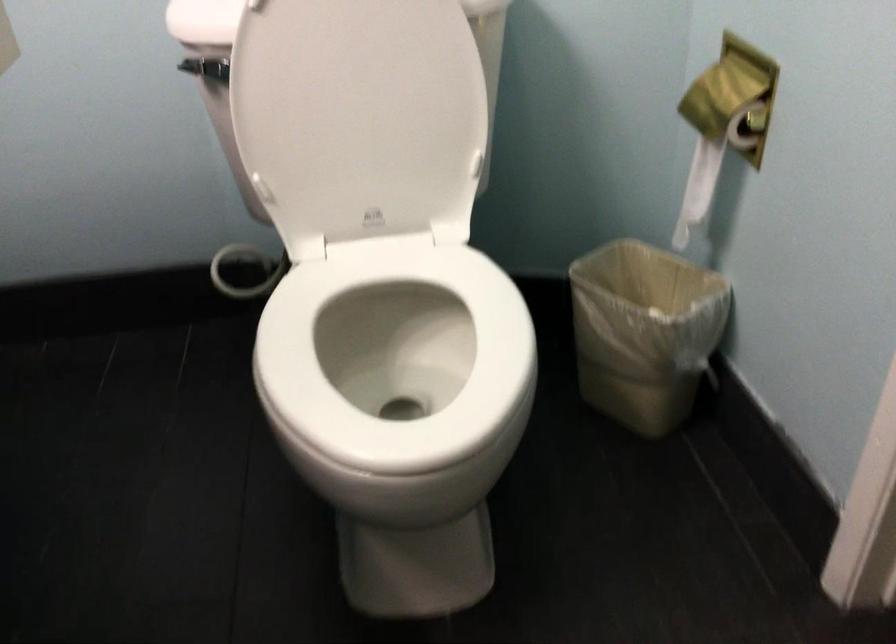
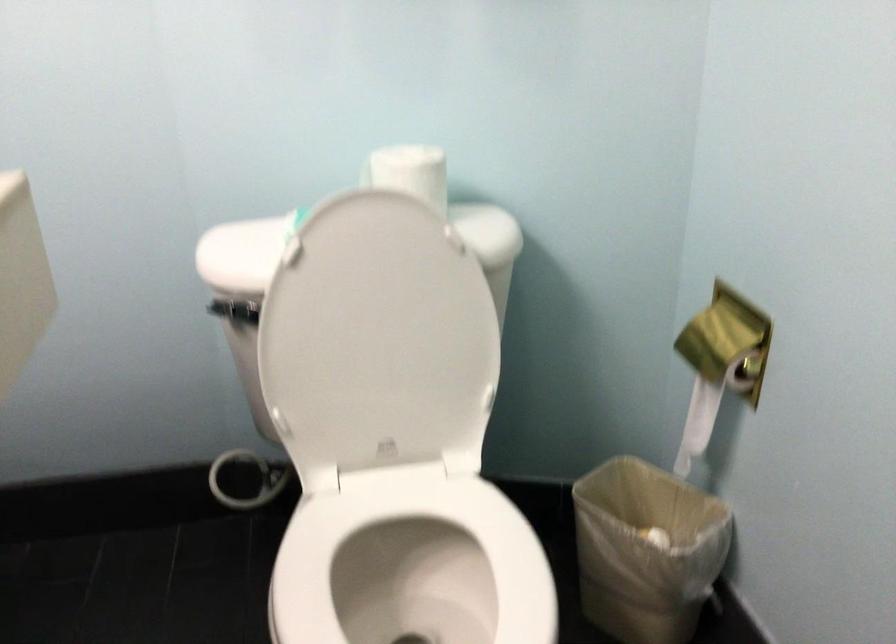
Question: Based on the continuous images, in which direction is the camera rotating? Reply with the corresponding letter.

Choices:
 (A) Left
 (B) Right
 (C) Up
 (D) Down

Answer: (C)